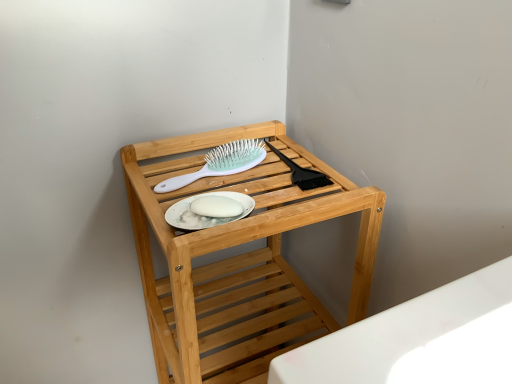
Question: Is white plastic hairbrush at upper center positioned before natural wood shelf at center?

Choices:
 (A) yes
 (B) no

Answer: (B)

Question: Does white plastic hairbrush at upper center have a lesser width compared to natural wood shelf at center?

Choices:
 (A) no
 (B) yes

Answer: (B)

Question: Is white plastic hairbrush at upper center directly adjacent to natural wood shelf at center?

Choices:
 (A) no
 (B) yes

Answer: (A)

Question: Could you tell me if white plastic hairbrush at upper center is turned towards natural wood shelf at center?

Choices:
 (A) no
 (B) yes

Answer: (B)

Question: Can you confirm if white plastic hairbrush at upper center is positioned to the right of natural wood shelf at center?

Choices:
 (A) yes
 (B) no

Answer: (B)

Question: Considering the positions of white matte platter at center and natural wood shelf at center in the image, is white matte platter at center bigger or smaller than natural wood shelf at center?

Choices:
 (A) big
 (B) small

Answer: (B)

Question: Would you say white matte platter at center is inside or outside natural wood shelf at center?

Choices:
 (A) inside
 (B) outside

Answer: (A)

Question: Is point (185, 223) closer or farther from the camera than point (257, 332)?

Choices:
 (A) closer
 (B) farther

Answer: (A)

Question: From the image's perspective, relative to natural wood shelf at center, is white matte platter at center above or below?

Choices:
 (A) below
 (B) above

Answer: (B)

Question: Is white plastic hairbrush at upper center inside or outside of white matte platter at center?

Choices:
 (A) outside
 (B) inside

Answer: (A)

Question: In terms of width, does white plastic hairbrush at upper center look wider or thinner when compared to white matte platter at center?

Choices:
 (A) wide
 (B) thin

Answer: (A)

Question: Is white plastic hairbrush at upper center taller or shorter than white matte platter at center?

Choices:
 (A) short
 (B) tall

Answer: (B)

Question: Is white plastic hairbrush at upper center in front of or behind white matte platter at center in the image?

Choices:
 (A) behind
 (B) front

Answer: (A)

Question: Considering their positions, is natural wood shelf at center located in front of or behind white plastic hairbrush at upper center?

Choices:
 (A) front
 (B) behind

Answer: (A)

Question: Looking at their shapes, would you say natural wood shelf at center is wider or thinner than white plastic hairbrush at upper center?

Choices:
 (A) thin
 (B) wide

Answer: (B)